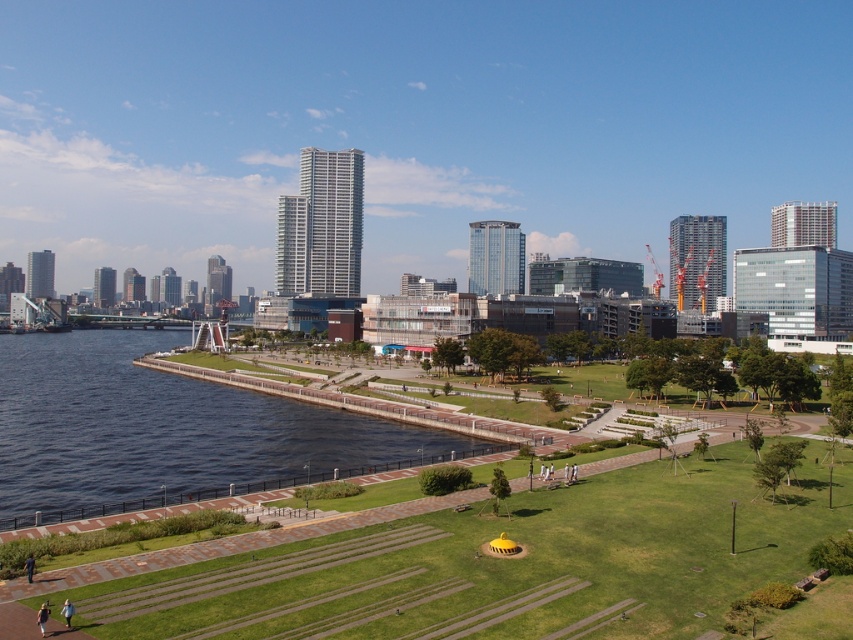
You are a landscape architect designing a new park. You want to place a new bench in the scene so that it can be seen from both the green grass at lower center and the blue glassy water at lower left. Based on their sizes, which area should the bench be closer to?

The bench should be placed closer to the blue glassy water at lower left since it has a larger size compared to the green grass at lower center, making it easier to view from both areas.

You are standing at the yellow circular structure in the center of the park. Looking towards the waterfront, you see a point marked at coordinates (505,566). What is located at that point?

The point at coordinates (505,566) marks green grass at lower center.

You are a gardener who needs to mow the lawn. You see the green grass at lower center and the blue glassy water at lower left. Which area should you avoid mowing?

You should avoid mowing the blue glassy water at lower left because it is a body of water and not grass. The green grass at lower center is the area that needs mowing.